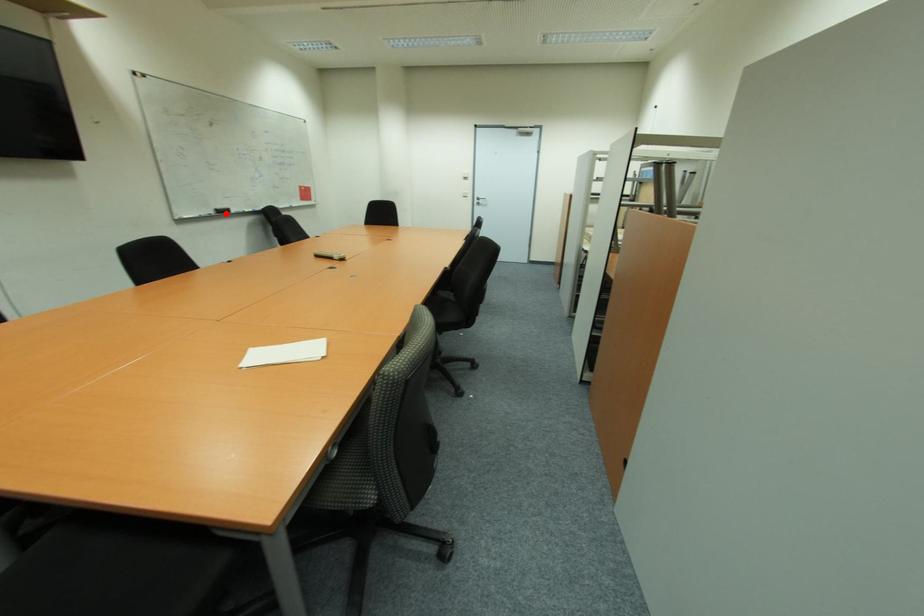
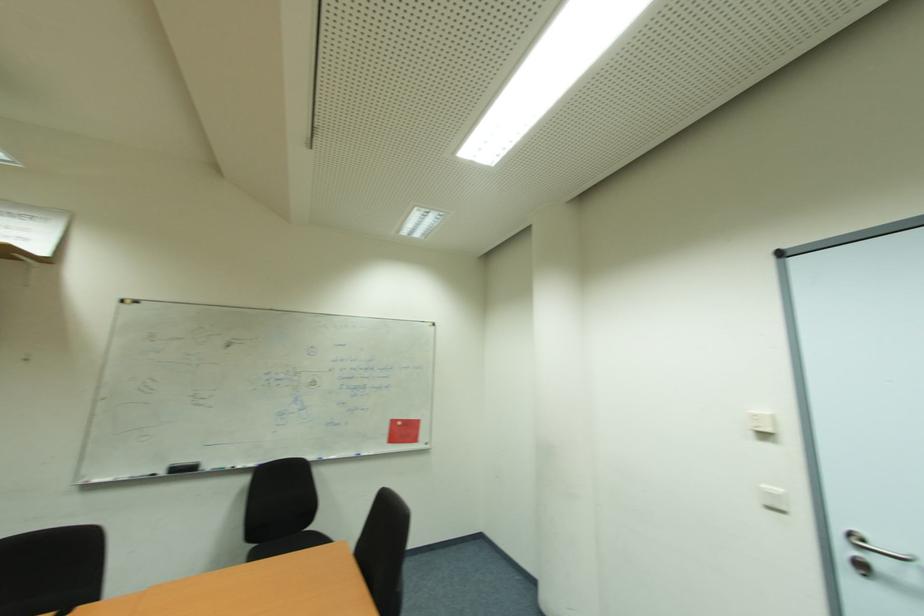
Question: A red point is marked in image1. In image2, is the corresponding 3D point closer to the camera or farther? Reply with the corresponding letter.

Choices:
 (A) The corresponding 3D point is closer.
 (B) The corresponding 3D point is farther.

Answer: (B)